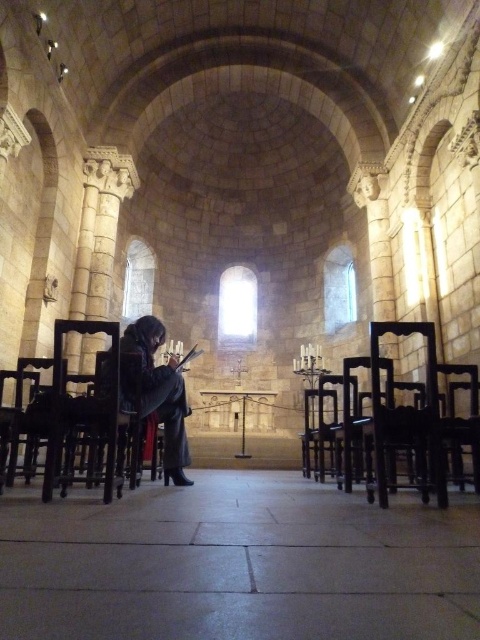
Who is positioned more to the right, dark gray wool coat at center or wooden chair at center?

wooden chair at center is more to the right.

This screenshot has width=480, height=640. What do you see at coordinates (156, 392) in the screenshot?
I see `dark gray wool coat at center` at bounding box center [156, 392].

At what (x,y) coordinates should I click in order to perform the action: click on dark gray wool coat at center. Please return your answer as a coordinate pair (x, y). The height and width of the screenshot is (640, 480). Looking at the image, I should click on (156, 392).

Does dark wood chair at right appear on the right side of black wood chair at center?

Indeed, dark wood chair at right is positioned on the right side of black wood chair at center.

Can you confirm if dark wood chair at right is smaller than black wood chair at center?

No.

Which is in front, point (417, 452) or point (348, 436)?

Positioned in front is point (417, 452).

Image resolution: width=480 pixels, height=640 pixels. I want to click on dark wood chair at right, so click(408, 417).

Who is taller, smooth stone floor at center or wooden chair at left?

With more height is wooden chair at left.

Is smooth stone floor at center wider than wooden chair at left?

Yes.

Does point (419, 540) come behind point (59, 474)?

No, (419, 540) is closer to viewer.

Identify the location of smooth stone floor at center. The width and height of the screenshot is (480, 640). (238, 564).